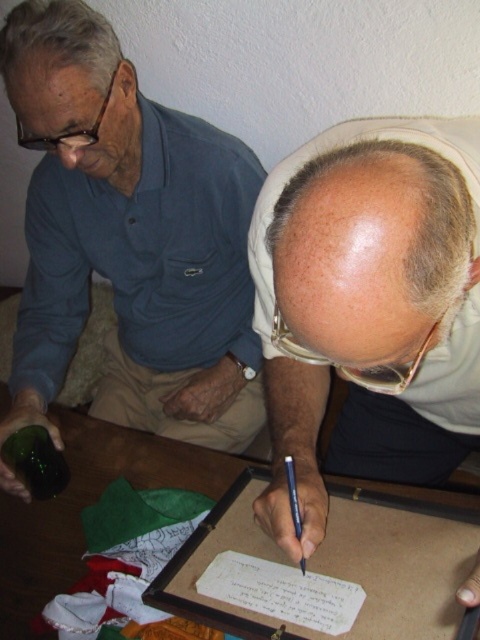
You are a person who needs to reach for the metallic blue pen at lower center to sign a document. However, there is a green matte bottle at lower left in the way. Can you move the bottle to access the pen?

The green matte bottle at lower left is positioned over the metallic blue pen at lower center, so moving the bottle would allow access to the pen.

You are a photographer who needs to capture a closeup shot of the green matte bottle at lower left. The camera is currently 36.21 inches away from the bottle. If you want to get a closer shot, should you move towards or away from the bottle?

The green matte bottle at lower left and camera are 36.21 inches apart from each other. To get a closer shot, you should move towards the bottle to reduce the distance between the camera and the bottle.

You are a photographer who needs to set up a camera to capture a closeup shot of the wooden table at center. The camera must be placed exactly 70 centimeters away from the table. Based on the scene description, can you position the camera correctly?

The wooden table at center and camera are 73.41 centimeters apart, so the camera is currently 3.41 centimeters too far to meet the requirement of 70 centimeters. Move it closer by approximately 3.41 centimeters.